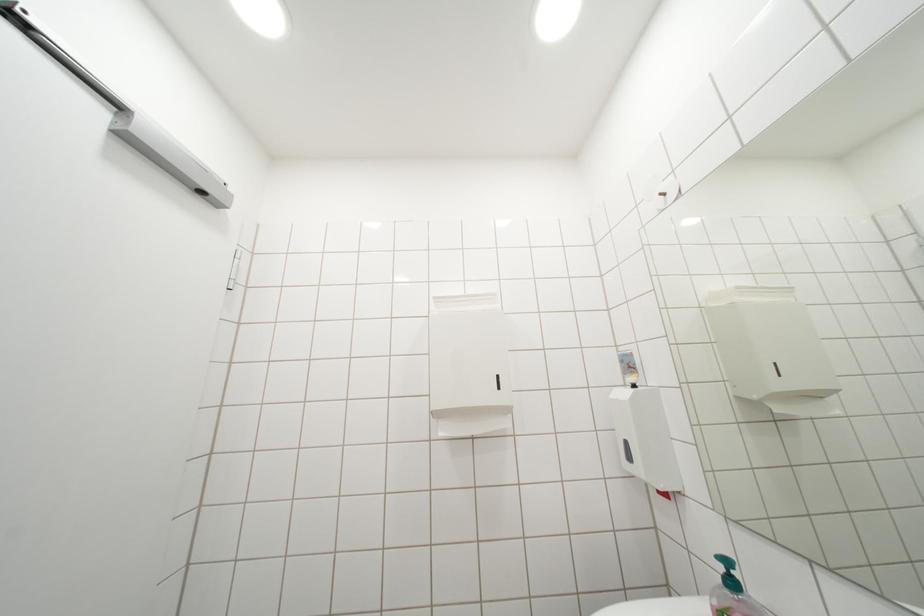
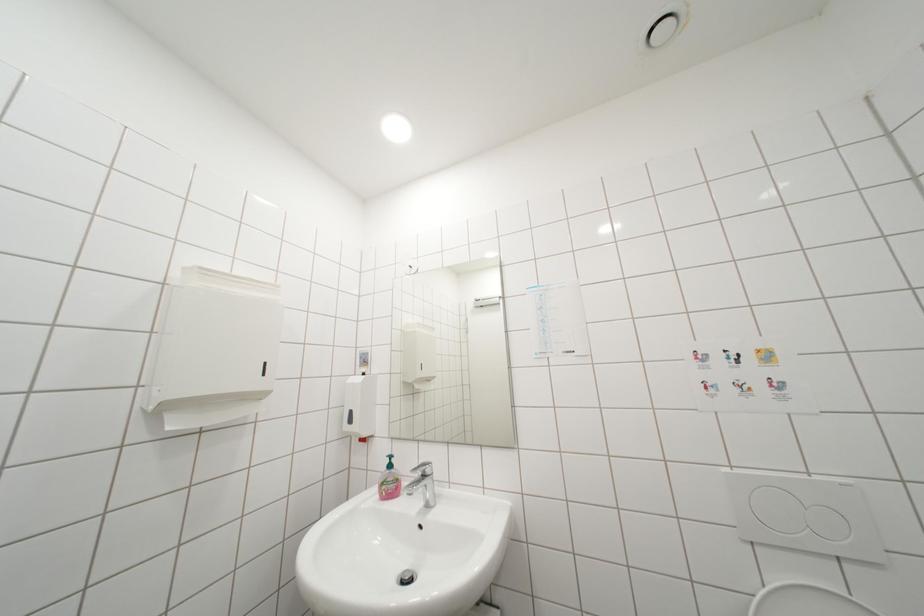
Question: How did the camera likely rotate?

Choices:
 (A) Left
 (B) Right
 (C) Up
 (D) Down

Answer: (B)